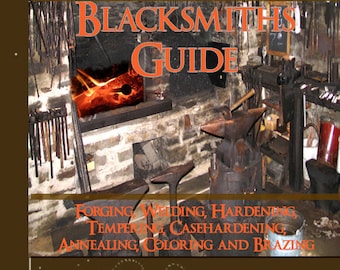
Image resolution: width=340 pixels, height=270 pixels. I want to click on table, so click(245, 123).